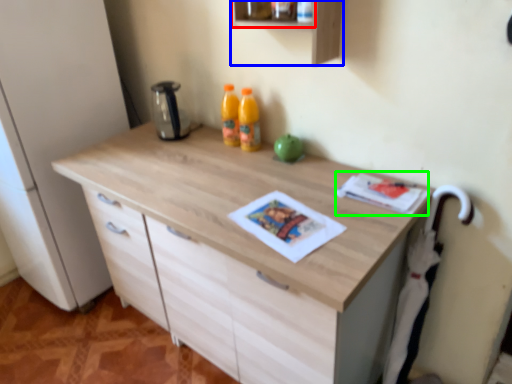
Question: Estimate the real-world distances between objects in this image. Which object is closer to shelf (highlighted by a red box), shelf (highlighted by a blue box) or magazine (highlighted by a green box)?

Choices:
 (A) shelf
 (B) magazine

Answer: (A)